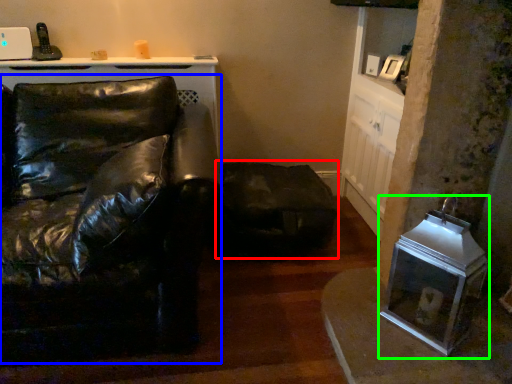
Question: Estimate the real-world distances between objects in this image. Which object is farther from swivel chair (highlighted by a red box), studio couch (highlighted by a blue box) or appliance (highlighted by a green box)?

Choices:
 (A) studio couch
 (B) appliance

Answer: (A)